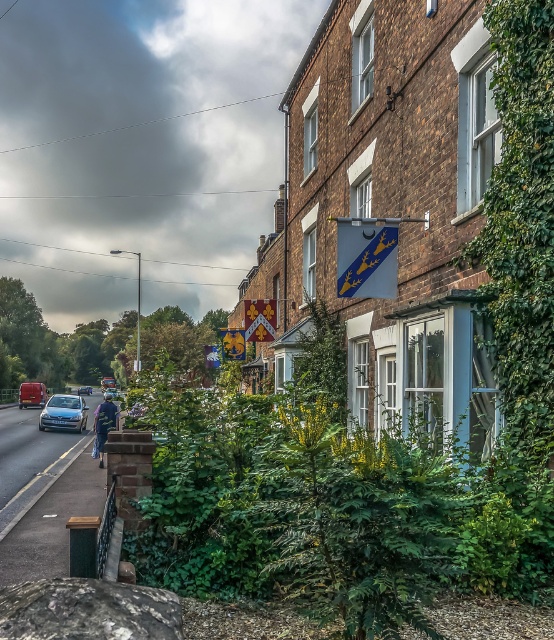
Question: Does satin silver sedan at lower left appear on the right side of silver metallic car at center?

Choices:
 (A) no
 (B) yes

Answer: (B)

Question: Is satin silver sedan at lower left bigger than metallic silver van at left?

Choices:
 (A) no
 (B) yes

Answer: (A)

Question: Does satin silver sedan at lower left appear over metallic silver van at left?

Choices:
 (A) no
 (B) yes

Answer: (B)

Question: Which point appears farthest from the camera in this image?

Choices:
 (A) (76, 413)
 (B) (28, 404)

Answer: (B)

Question: Which object is positioned farthest from the silver metallic car at center?

Choices:
 (A) metallic silver van at left
 (B) satin silver sedan at lower left

Answer: (B)

Question: Which point appears closest to the camera in this image?

Choices:
 (A) (29, 381)
 (B) (84, 387)
 (C) (69, 401)

Answer: (C)